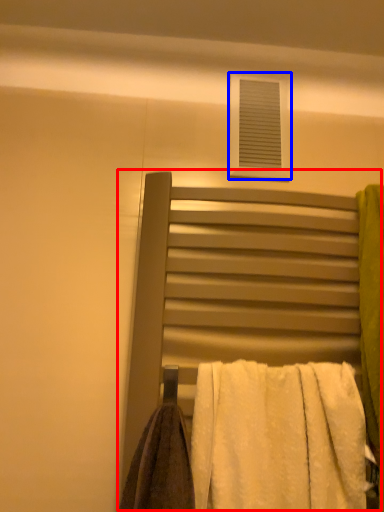
Question: Which of the following is the farthest to the observer, bed (highlighted by a red box) or window (highlighted by a blue box)?

Choices:
 (A) bed
 (B) window

Answer: (B)